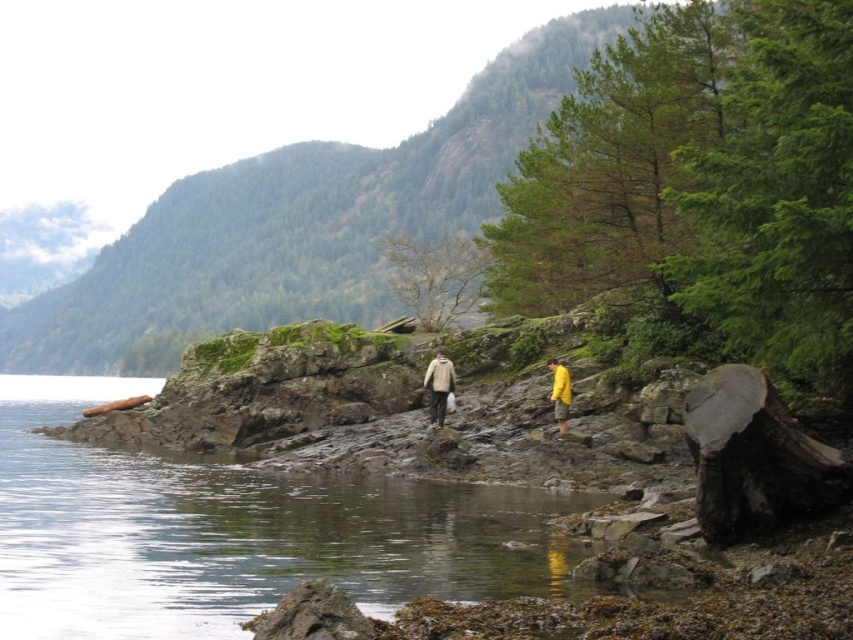
Question: Among these points, which one is farthest from the camera?

Choices:
 (A) (556, 396)
 (B) (136, 404)
 (C) (556, 387)
 (D) (90, 538)

Answer: (B)

Question: Can you confirm if clear water at center is bigger than brown wood log at lower left?

Choices:
 (A) no
 (B) yes

Answer: (B)

Question: Does beige wool sweater at center have a smaller size compared to yellow matte jacket at center-right?

Choices:
 (A) no
 (B) yes

Answer: (A)

Question: Can you confirm if clear water at center is wider than brown wood log at lower left?

Choices:
 (A) no
 (B) yes

Answer: (B)

Question: Which object is farther from the camera taking this photo?

Choices:
 (A) brown wood log at lower left
 (B) clear water at center
 (C) yellow waterproof jacket at center

Answer: (A)

Question: Which point is farther to the camera?

Choices:
 (A) (390, 525)
 (B) (556, 365)
 (C) (136, 403)
 (D) (552, 364)

Answer: (C)